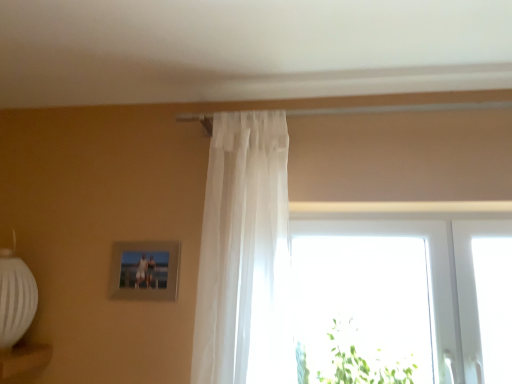
Question: Is metallic silver picture frame at upper left inside the boundaries of transparent glass window at center, or outside?

Choices:
 (A) outside
 (B) inside

Answer: (A)

Question: In the image, is metallic silver picture frame at upper left positioned in front of or behind transparent glass window at center?

Choices:
 (A) behind
 (B) front

Answer: (A)

Question: Which object is the closest to the green leafy plant at lower right?

Choices:
 (A) sheer white curtain at center
 (B) metallic silver picture frame at upper left
 (C) transparent glass window at center

Answer: (C)

Question: Estimate the real-world distances between objects in this image. Which object is closer to the transparent glass window at center?

Choices:
 (A) green leafy plant at lower right
 (B) metallic silver picture frame at upper left
 (C) sheer white curtain at center

Answer: (A)